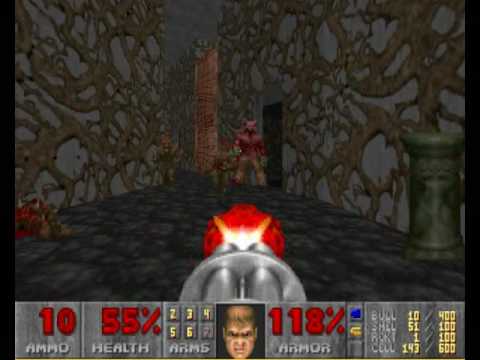
The height and width of the screenshot is (360, 480). Find the location of `column`. column is located at coordinates (420, 202).